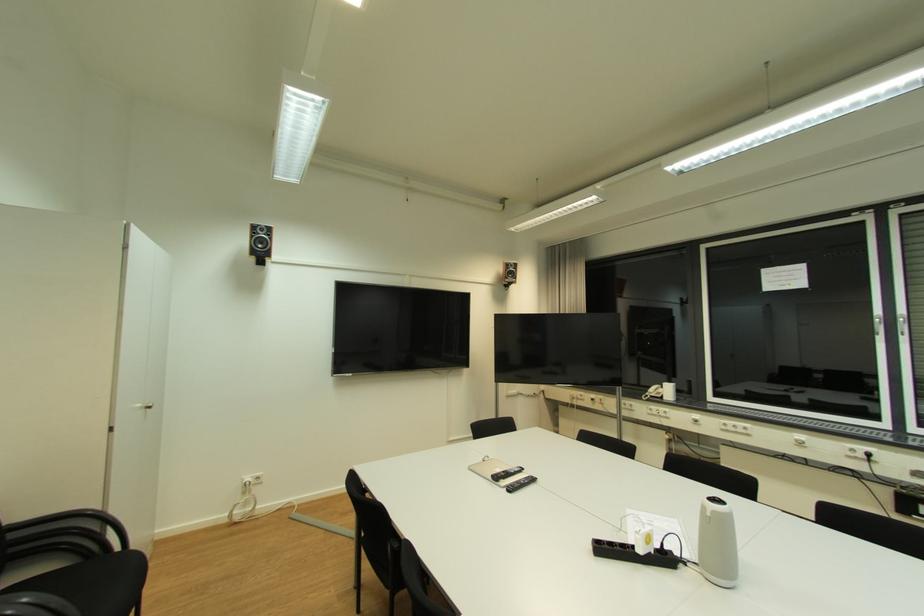
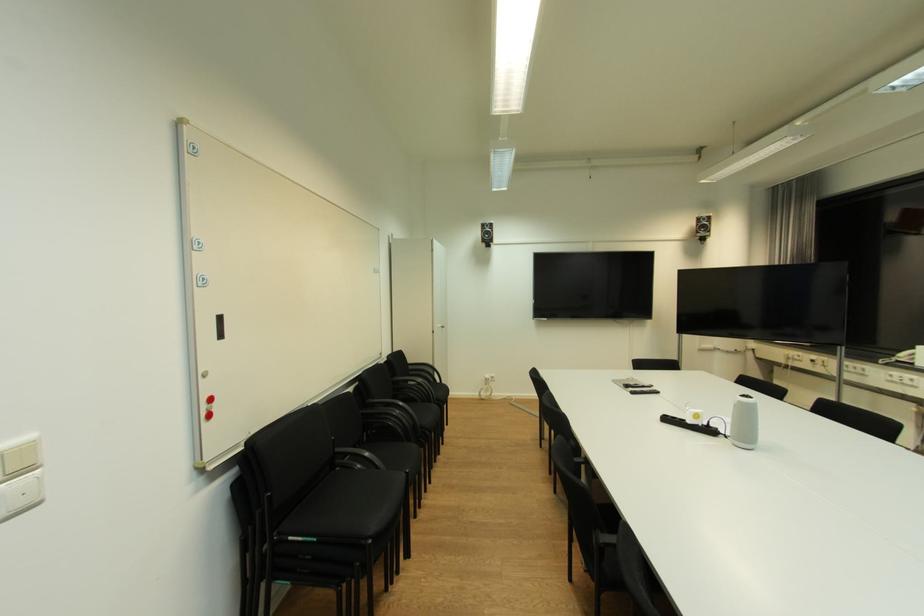
Find the pixel in the second image that matches (x=608, y=551) in the first image.

(674, 421)